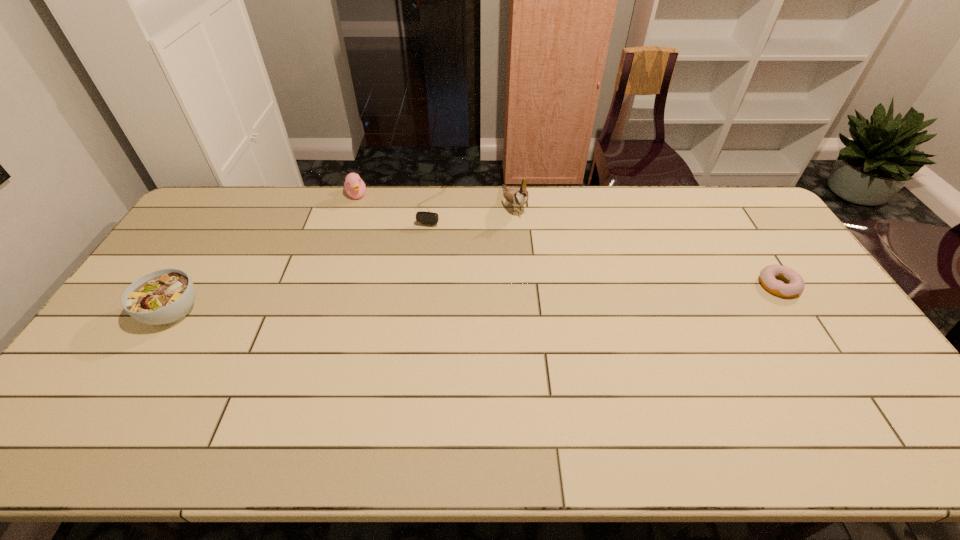
The image size is (960, 540). Find the location of `soup bowl`. soup bowl is located at coordinates (165, 296).

Find the location of a particular element. Image resolution: width=960 pixels, height=540 pixels. the shortest object is located at coordinates (768, 275).

Locate an element on the screen. The width and height of the screenshot is (960, 540). the rightmost object is located at coordinates (768, 275).

Find the location of `the second shortest object`. the second shortest object is located at coordinates (432, 218).

You are a GUI agent. You are given a task and a screenshot of the screen. Output one action in this format:
    pyautogui.click(x=<x>, y=<y>)
    Task: Click on the webcam
    
    Given the screenshot: What is the action you would take?
    pyautogui.click(x=432, y=218)

This screenshot has height=540, width=960. Identify the location of duckling. (355, 187).

This screenshot has width=960, height=540. Find the location of `bird`. bird is located at coordinates (518, 197).

Find the location of a particular element. The width and height of the screenshot is (960, 540). the tallest object is located at coordinates (518, 197).

Locate an element on the screen. vacant space situated 0.280m on the right of the soup bowl is located at coordinates (300, 312).

The image size is (960, 540). I want to click on free spot located on the back of the rightmost object, so click(x=730, y=209).